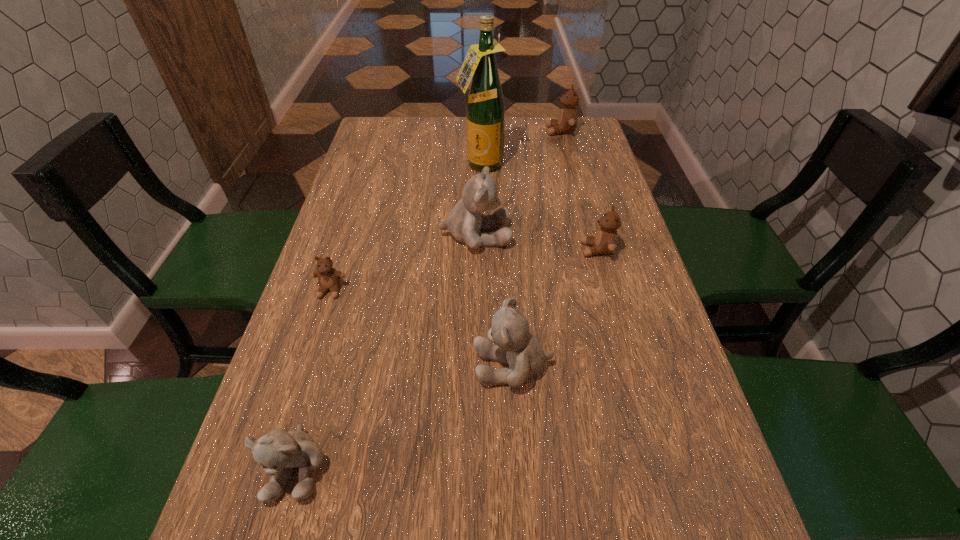
This screenshot has width=960, height=540. Find the location of `the second closest gray teddy bear to the second farthest gray teddy bear`. the second closest gray teddy bear to the second farthest gray teddy bear is located at coordinates (277, 451).

Select which gray teddy bear appears as the third closest to the tallest object. Please provide its 2D coordinates. Your answer should be formatted as a tuple, i.e. [(x, y)], where the tuple contains the x and y coordinates of a point satisfying the conditions above.

[(277, 451)]

Locate an element on the screen. The image size is (960, 540). brown teddy bear identified as the second closest to the biggest brown teddy bear is located at coordinates (329, 278).

Locate which brown teddy bear is the closest to the shortest teddy bear. Please provide its 2D coordinates. Your answer should be formatted as a tuple, i.e. [(x, y)], where the tuple contains the x and y coordinates of a point satisfying the conditions above.

[(606, 239)]